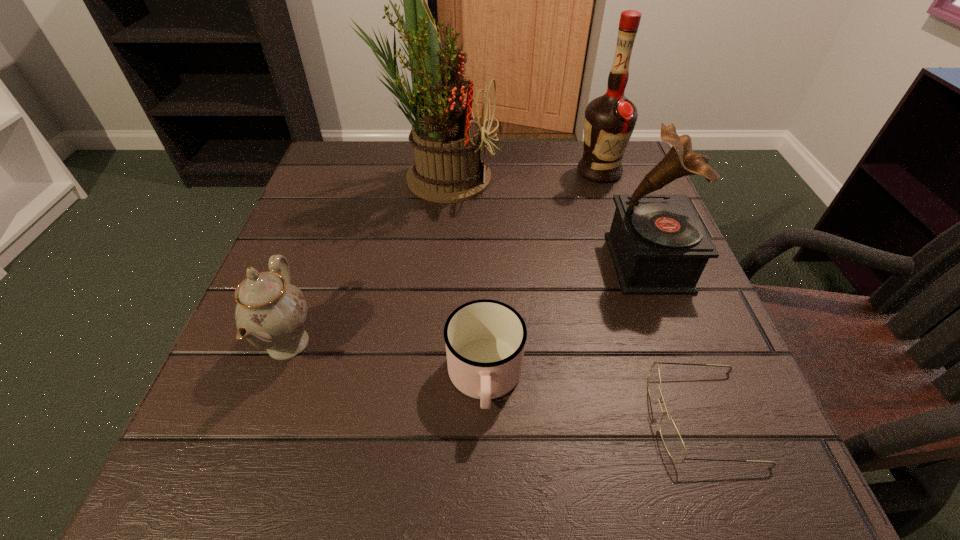
This screenshot has height=540, width=960. Find the location of `vacant space located at the horn opening of the third tallest object`. vacant space located at the horn opening of the third tallest object is located at coordinates (460, 263).

Where is `vacant region located at the horn opening of the third tallest object`? The width and height of the screenshot is (960, 540). vacant region located at the horn opening of the third tallest object is located at coordinates (586, 263).

At what (x,y) coordinates should I click in order to perform the action: click on free space located 0.200m at the horn opening of the third tallest object. Please return your answer as a coordinate pair (x, y). Looking at the image, I should click on (507, 263).

Where is `vacant space located 0.190m on the spout of the leftmost object`? The image size is (960, 540). vacant space located 0.190m on the spout of the leftmost object is located at coordinates (437, 344).

Identify the location of free space located 0.090m on the side of the fifth tallest object with the handle. The width and height of the screenshot is (960, 540). (486, 495).

Locate an element on the screen. This screenshot has width=960, height=540. vacant position located on the front-facing side of the spectacles is located at coordinates (393, 417).

Locate an element on the screen. Image resolution: width=960 pixels, height=540 pixels. free region located on the front-facing side of the spectacles is located at coordinates (442, 417).

Locate an element on the screen. Image resolution: width=960 pixels, height=540 pixels. vacant space located 0.260m on the front-facing side of the spectacles is located at coordinates (470, 417).

Where is `flower arrangement present at the far edge`? The height and width of the screenshot is (540, 960). flower arrangement present at the far edge is located at coordinates (446, 139).

I want to click on liquor at the far edge, so click(609, 120).